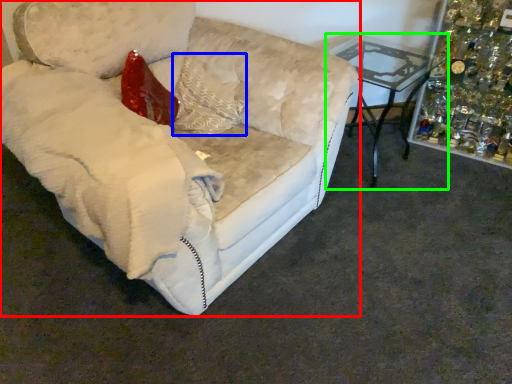
Question: Considering the real-world distances, which object is farthest from studio couch (highlighted by a red box)? pillow (highlighted by a blue box) or table (highlighted by a green box)?

Choices:
 (A) pillow
 (B) table

Answer: (B)